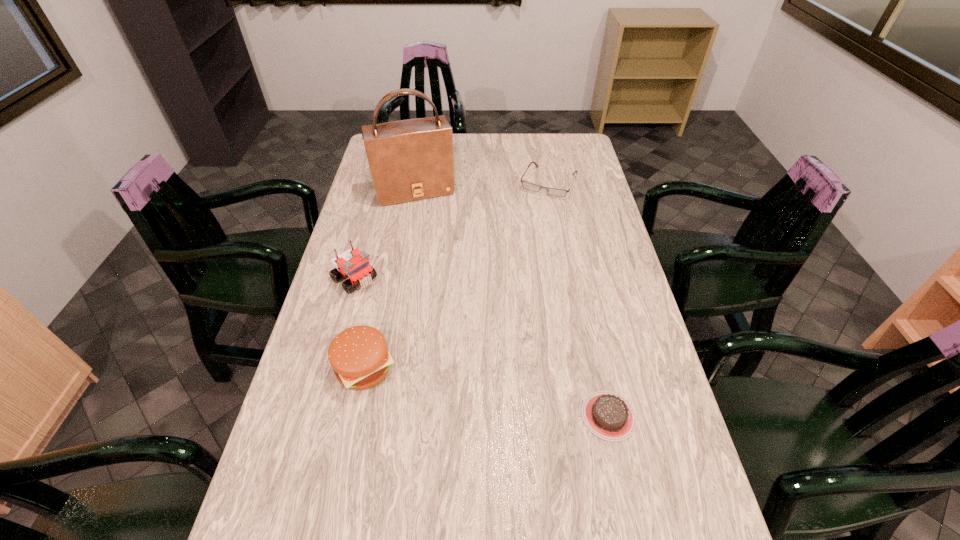
At what (x,y) coordinates should I click in order to perform the action: click on free space between the shoulder bag and the hamburger. Please return your answer as a coordinate pair (x, y). Looking at the image, I should click on (389, 279).

Where is `free space that is in between the second shortest object and the hamburger`? This screenshot has height=540, width=960. free space that is in between the second shortest object and the hamburger is located at coordinates (456, 275).

You are a GUI agent. You are given a task and a screenshot of the screen. Output one action in this format:
    pyautogui.click(x=<x>, y=<y>)
    Task: Click on the vacant space that's between the third farthest object and the hamburger
    This screenshot has height=540, width=960.
    Given the screenshot: What is the action you would take?
    pyautogui.click(x=359, y=323)

The width and height of the screenshot is (960, 540). Find the location of `blank region between the Lego and the shoulder bag`. blank region between the Lego and the shoulder bag is located at coordinates (384, 234).

At what (x,y) coordinates should I click in order to perform the action: click on free spot between the spectacles and the third tallest object. Please return your answer as a coordinate pair (x, y). Looking at the image, I should click on (456, 275).

Where is `vacant area that lies between the second tallest object and the second shortest object`? The image size is (960, 540). vacant area that lies between the second tallest object and the second shortest object is located at coordinates (451, 231).

Find the location of `free space between the shoulder bag and the shortest object`. free space between the shoulder bag and the shortest object is located at coordinates (512, 303).

Where is `the fourth closest object to the shortest object`? The height and width of the screenshot is (540, 960). the fourth closest object to the shortest object is located at coordinates (409, 160).

You are a GUI agent. You are given a task and a screenshot of the screen. Output one action in this format:
    pyautogui.click(x=<x>, y=<y>)
    Task: Click on the object that can be found as the second closest to the hamburger
    This screenshot has width=960, height=540.
    Given the screenshot: What is the action you would take?
    pyautogui.click(x=608, y=415)